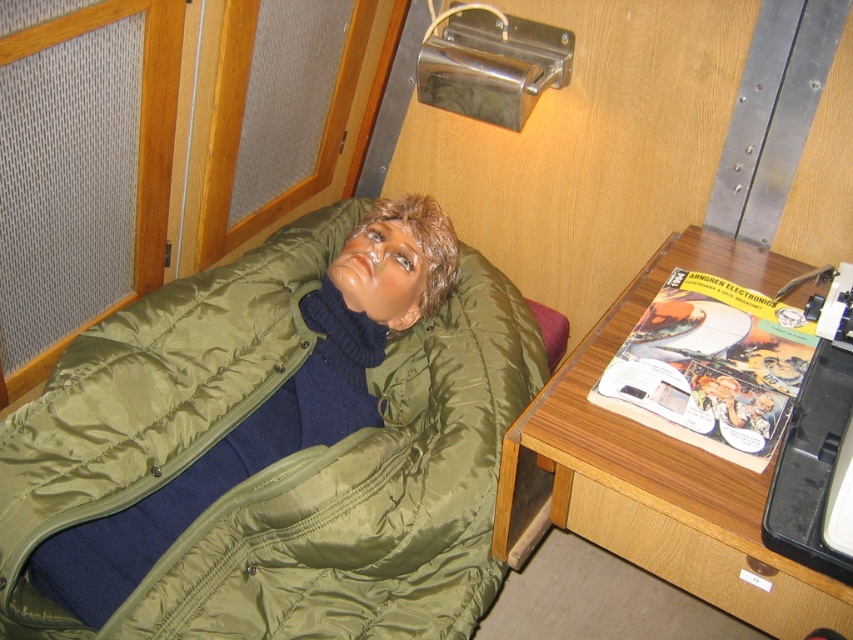
Question: Does olive green quilted jacket at center appear under wooden desk at lower right?

Choices:
 (A) yes
 (B) no

Answer: (B)

Question: Which object is closer to the camera taking this photo?

Choices:
 (A) olive green quilted jacket at center
 (B) wooden desk at lower right

Answer: (B)

Question: Is olive green quilted jacket at center to the right of wooden desk at lower right from the viewer's perspective?

Choices:
 (A) no
 (B) yes

Answer: (A)

Question: Is olive green quilted jacket at center wider than wooden desk at lower right?

Choices:
 (A) yes
 (B) no

Answer: (A)

Question: Which of the following is the closest to the observer?

Choices:
 (A) 741,266
 (B) 20,417

Answer: (B)